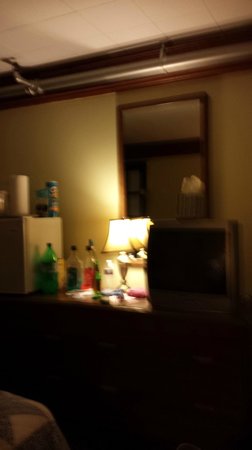
Where is `lamp shade`? lamp shade is located at coordinates (115, 240).